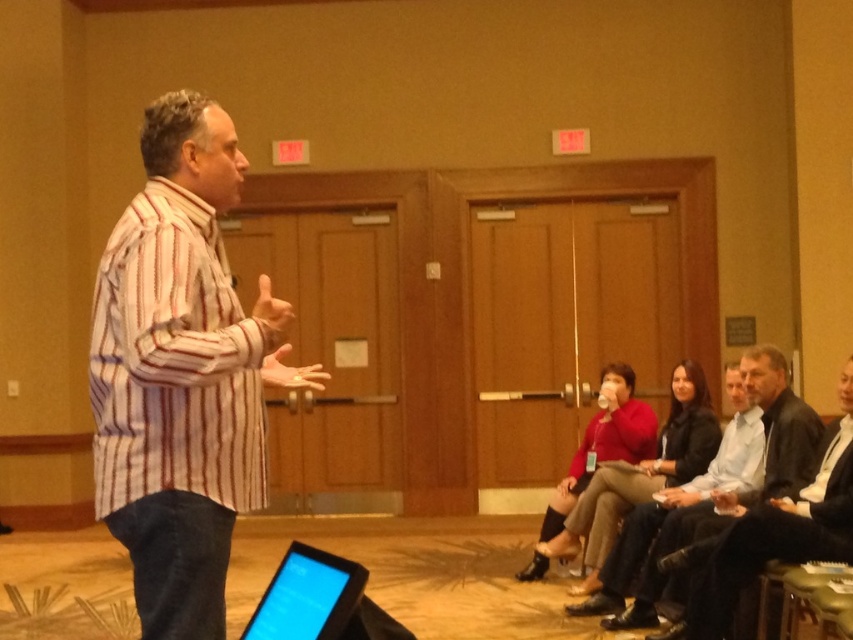
Looking at this image, you are a photographer standing in the back of the conference room. You want to take a photo of the dark gray leather jacket at lower right and the red matte sweater at center. Which one is more to the right?

The dark gray leather jacket at lower right is more to the right than the red matte sweater at center.

You are standing at the center of the conference room and see the dark gray leather jacket at lower right. If you walk straight towards the jacket, will you reach it before the laptop?

The dark gray leather jacket at lower right is located at point (770, 532). The laptop is placed on a surface not fully visible, so its exact position isn not provided. Therefore, it is impossible to determine if walking straight towards the jacket would reach it before the laptop without knowing the laptop location.